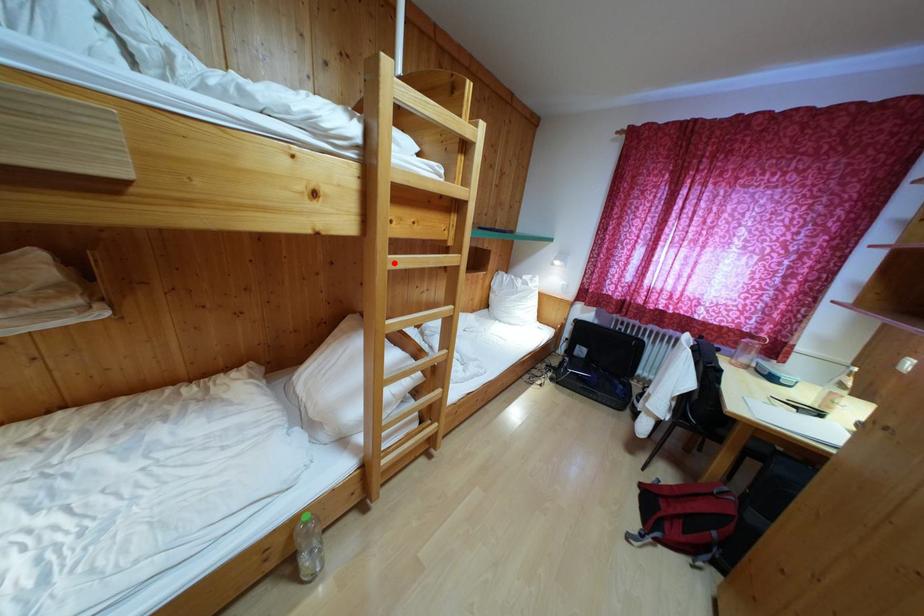
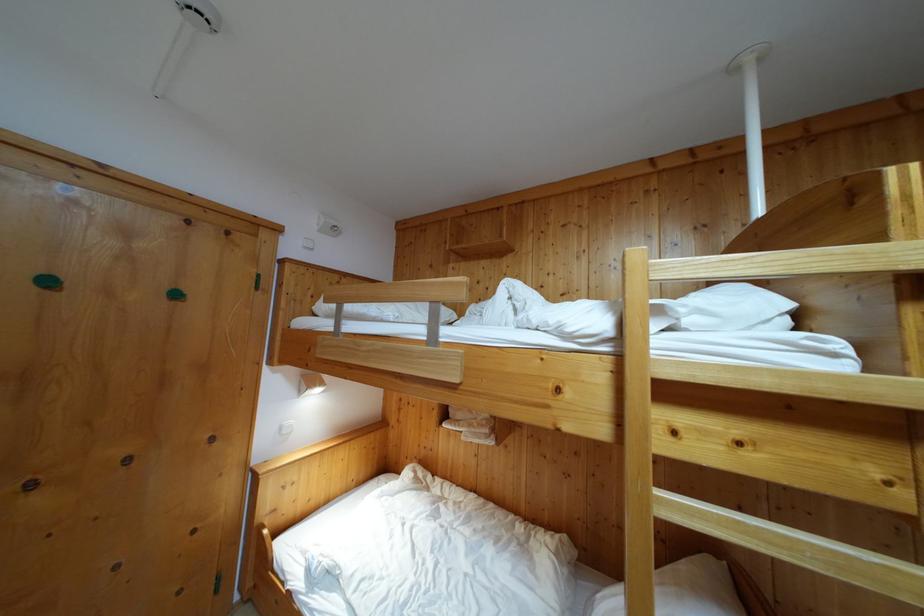
Question: I am providing you with two images of the same scene from different viewpoints. Given a red point in image1, look at the same physical point in image2. Is it:

Choices:
 (A) Closer to the viewpoint
 (B) Farther from the viewpoint

Answer: (B)